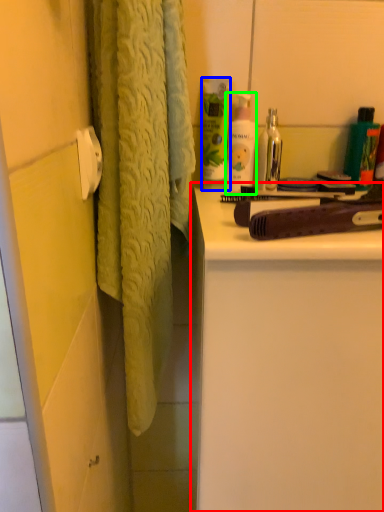
Question: Considering the real-world distances, which object is closest to bathroom cabinet (highlighted by a red box)? cleaning product (highlighted by a blue box) or toiletry (highlighted by a green box).

Choices:
 (A) cleaning product
 (B) toiletry

Answer: (B)